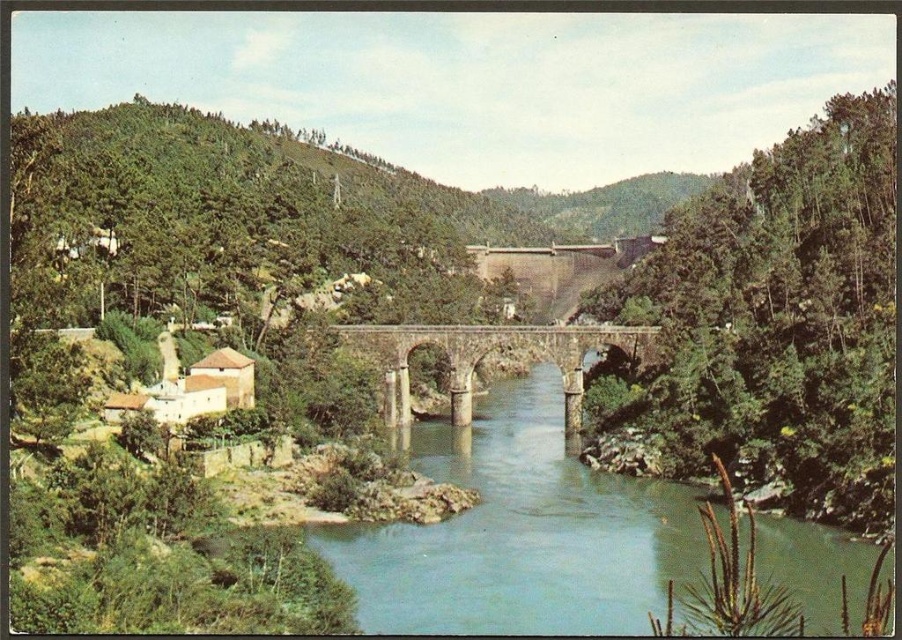
Which is above, green stone river at center or stone arch bridge at center?

stone arch bridge at center is higher up.

The image size is (902, 640). What do you see at coordinates (520, 532) in the screenshot?
I see `green stone river at center` at bounding box center [520, 532].

Measure the distance between green stone river at center and camera.

67.40 meters

At what (x,y) coordinates should I click in order to perform the action: click on green stone river at center. Please return your answer as a coordinate pair (x, y). The height and width of the screenshot is (640, 902). Looking at the image, I should click on (520, 532).